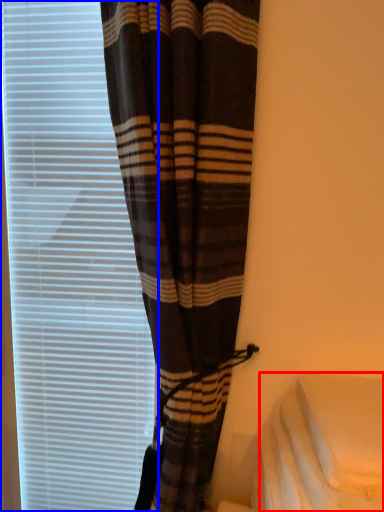
Question: Which object appears farthest to the camera in this image, sheet (highlighted by a red box) or window blind (highlighted by a blue box)?

Choices:
 (A) sheet
 (B) window blind

Answer: (B)